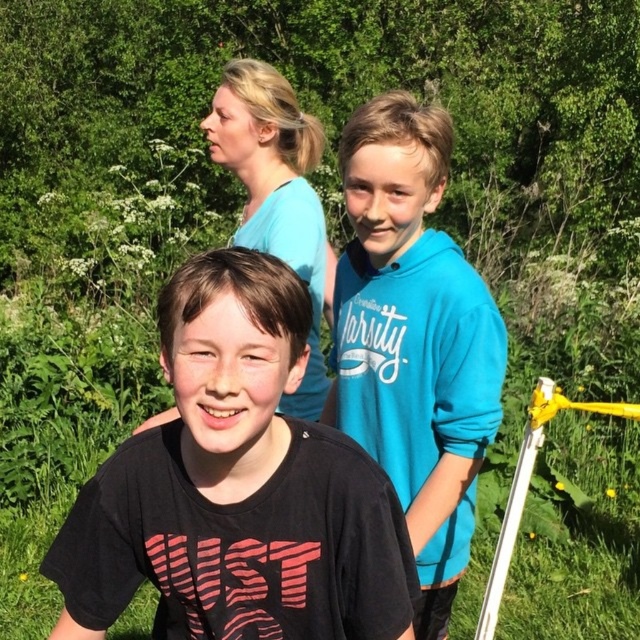
You are taking a photo of the scene described. The camera you are using has a focus point at coordinates 0.75, 0.37. Will the black matte shirt at center be in focus?

The black matte shirt at center is located at point (237,484), which is very close to the camera focus point at (236,480). Therefore, the black matte shirt at center will be in focus.

Looking at this image, you are a photographer trying to capture a group photo of the two boys and the woman. You notice the blue fleece hoodie at center and the blue cotton shirt at upper center. Which clothing item should you focus on first to ensure it appears sharp in the photo if you want both to be in focus?

The blue fleece hoodie at center is larger in size compared to the blue cotton shirt at upper center, so focusing on the larger blue fleece hoodie at center will help ensure both are in focus as it requires a smaller aperture for depth of field.

You are taking a photo of two boys wearing different colored shirts. The black matte shirt at center and the blue cotton shirt at upper center. Which shirt is positioned to the left in the image?

The black matte shirt at center is positioned to the left of the blue cotton shirt at upper center in the image.